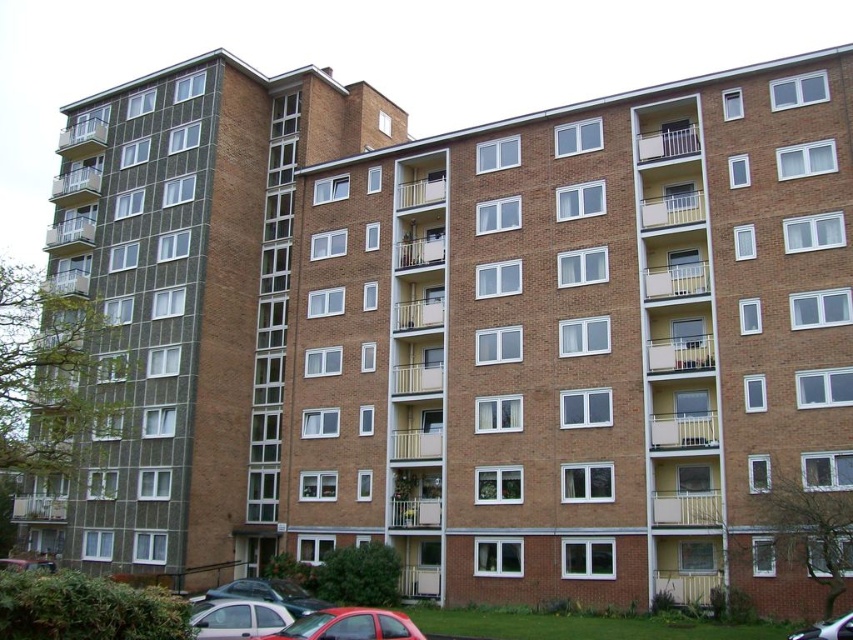
You are a delivery person needing to park your vehicle in this area. There are two metallic silver cars already parked here. How far apart are the metallic silver car at lower right and the metallic silver car at lower left?

The metallic silver car at lower right is 169.79 feet away from the metallic silver car at lower left.

You are a delivery person trying to park your truck between the matte red car at lower center and the silver metallic car at lower left. Your truck is 2 meters tall. Can you fit your truck between them without hitting the roof?

The matte red car at lower center is taller than the silver metallic car at lower left. Since the truck is 2 meters tall, but we don not know the exact height of the cars, it is impossible to determine if the truck can fit without additional information.

You are a delivery driver who needs to park your truck between the matte red car at lower center and the metallic silver car at lower left. Your truck is 12 meters long. Is there enough space between them to park your truck?

The distance between the matte red car at lower center and the metallic silver car at lower left is 39.25 meters. Since your truck is 12 meters long, there is sufficient space to park between them as 39.25 meters is greater than 12 meters.